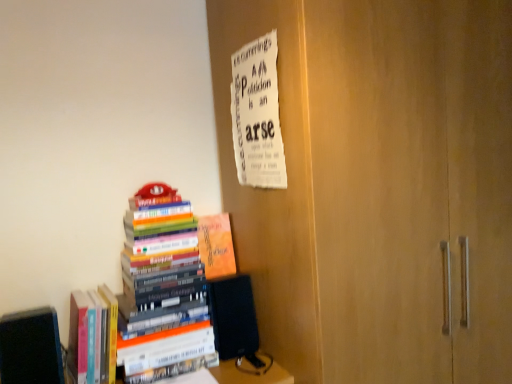
Question: Is black matte book at lower left, marked as the first book in a left-to-right arrangement, at the back of hardcover books at left, which is counted as the third book, starting from the left?

Choices:
 (A) yes
 (B) no

Answer: (B)

Question: Is hardcover books at left, which appears as the second book when viewed from the right, shorter than black matte book at lower left, marked as the first book in a left-to-right arrangement?

Choices:
 (A) no
 (B) yes

Answer: (A)

Question: Is hardcover books at left, which appears as the second book when viewed from the right, at the right side of black matte book at lower left, marked as the first book in a left-to-right arrangement?

Choices:
 (A) no
 (B) yes

Answer: (B)

Question: From the image's perspective, would you say hardcover books at left, which appears as the second book when viewed from the right, is shown under black matte book at lower left, marked as the first book in a left-to-right arrangement?

Choices:
 (A) yes
 (B) no

Answer: (B)

Question: Does hardcover books at left, which appears as the second book when viewed from the right, have a smaller size compared to black matte book at lower left, marked as the first book in a left-to-right arrangement?

Choices:
 (A) yes
 (B) no

Answer: (B)

Question: From a real-world perspective, is black matte book at lower left, marked as the first book in a left-to-right arrangement, positioned above or below white paper at upper center?

Choices:
 (A) above
 (B) below

Answer: (B)

Question: From the image's perspective, is black matte book at lower left, the 4th book viewed from the right, located above or below white paper at upper center?

Choices:
 (A) below
 (B) above

Answer: (A)

Question: Choose the correct answer: Is black matte book at lower left, the 4th book viewed from the right, inside white paper at upper center or outside it?

Choices:
 (A) outside
 (B) inside

Answer: (A)

Question: Relative to white paper at upper center, is black matte book at lower left, marked as the first book in a left-to-right arrangement, in front or behind?

Choices:
 (A) behind
 (B) front

Answer: (B)

Question: Looking at the image, does hardcover books at left, the second book in the left-to-right sequence, seem bigger or smaller compared to hardcover books at left, which is counted as the third book, starting from the left?

Choices:
 (A) big
 (B) small

Answer: (B)

Question: In terms of height, does hardcover books at left, which appears as the 3th book when viewed from the right, look taller or shorter compared to hardcover books at left, which is counted as the third book, starting from the left?

Choices:
 (A) short
 (B) tall

Answer: (A)

Question: From a real-world perspective, is hardcover books at left, the second book in the left-to-right sequence, positioned above or below hardcover books at left, which is counted as the third book, starting from the left?

Choices:
 (A) below
 (B) above

Answer: (A)

Question: Is hardcover books at left, which appears as the 3th book when viewed from the right, spatially inside hardcover books at left, which appears as the second book when viewed from the right, or outside of it?

Choices:
 (A) inside
 (B) outside

Answer: (B)

Question: From the image's perspective, relative to white paper at upper center, is hardcover books at left, which is counted as the third book, starting from the left, above or below?

Choices:
 (A) above
 (B) below

Answer: (B)

Question: Is hardcover books at left, which appears as the second book when viewed from the right, to the left or to the right of white paper at upper center in the image?

Choices:
 (A) left
 (B) right

Answer: (A)